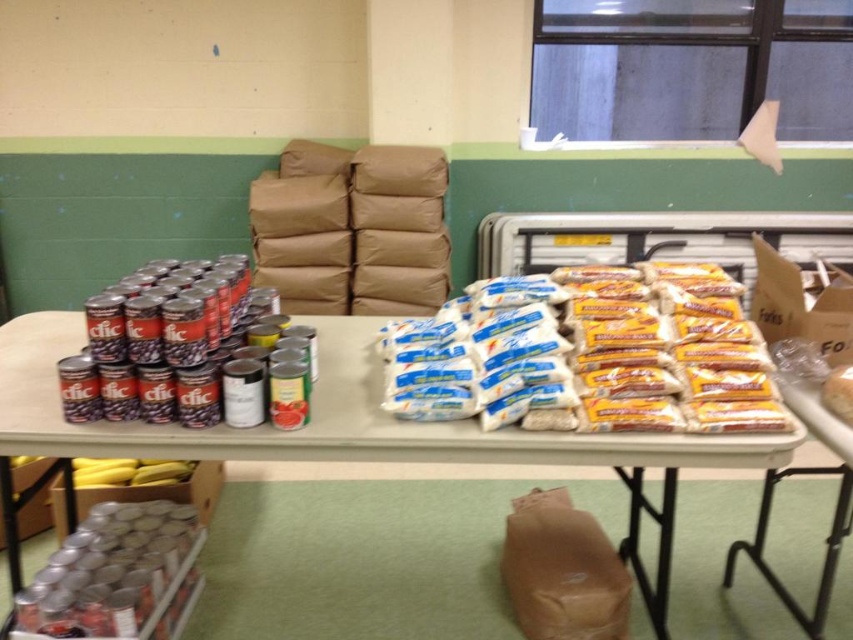
Question: Can you confirm if white paper bag at center is positioned to the right of white plastic table at center?

Choices:
 (A) no
 (B) yes

Answer: (B)

Question: From the image, what is the correct spatial relationship of white paper bag at center in relation to white plastic table at center?

Choices:
 (A) below
 (B) above

Answer: (B)

Question: Which point is farther to the camera?

Choices:
 (A) (412, 406)
 (B) (323, 353)

Answer: (B)

Question: Which point is closer to the camera taking this photo?

Choices:
 (A) (424, 374)
 (B) (335, 442)

Answer: (B)

Question: Which object is farther from the camera taking this photo?

Choices:
 (A) white paper bag at center
 (B) white plastic table at center

Answer: (A)

Question: Does white paper bag at center have a greater width compared to white plastic table at center?

Choices:
 (A) yes
 (B) no

Answer: (B)